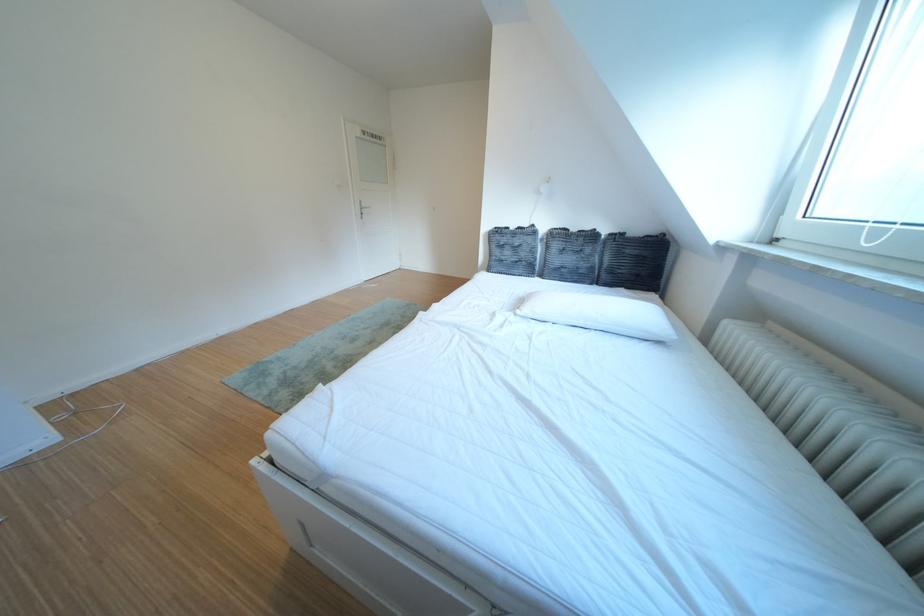
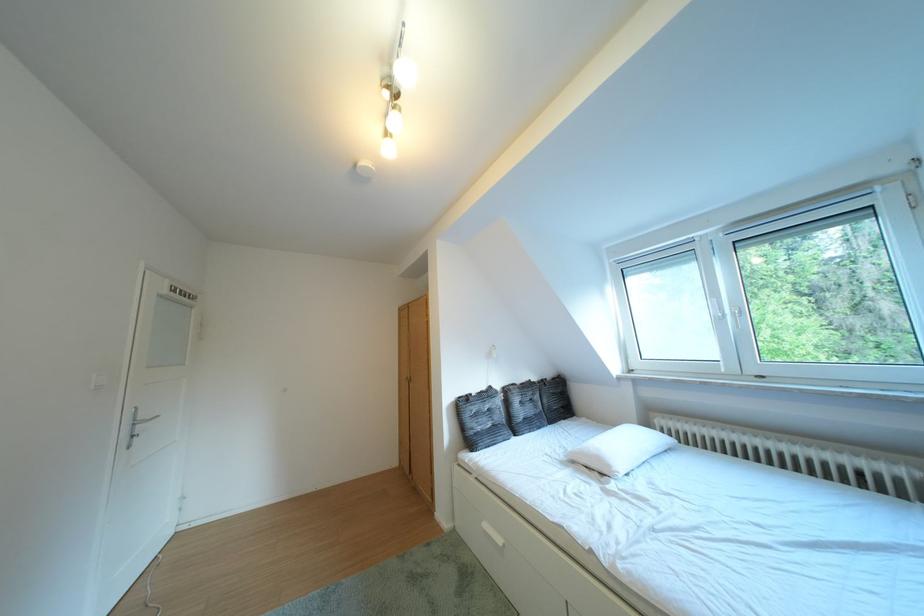
The point at (546, 232) is marked in the first image. Where is the corresponding point in the second image?

(504, 392)